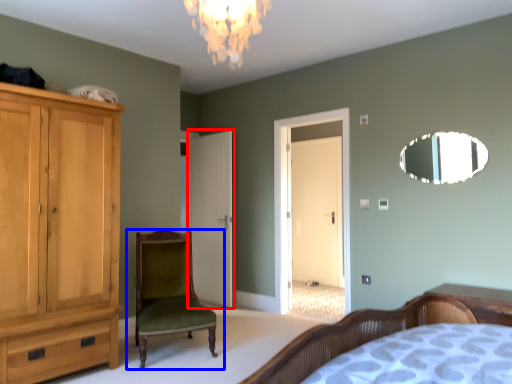
Question: Among these objects, which one is nearest to the camera, door (highlighted by a red box) or chair (highlighted by a blue box)?

Choices:
 (A) door
 (B) chair

Answer: (B)